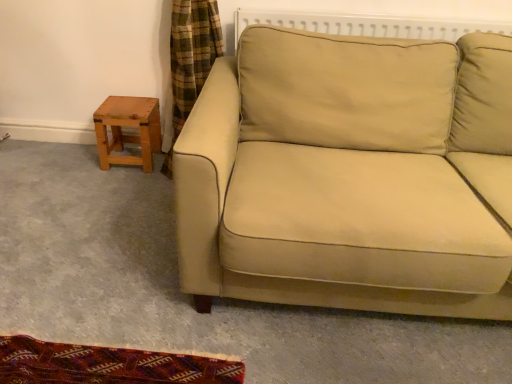
Question: From a real-world perspective, is light brown wooden stool at left positioned over beige fabric couch at center based on gravity?

Choices:
 (A) yes
 (B) no

Answer: (B)

Question: Does light brown wooden stool at left turn towards beige fabric couch at center?

Choices:
 (A) yes
 (B) no

Answer: (B)

Question: Is light brown wooden stool at left at the left side of beige fabric couch at center?

Choices:
 (A) no
 (B) yes

Answer: (B)

Question: Is light brown wooden stool at left positioned beyond the bounds of beige fabric couch at center?

Choices:
 (A) yes
 (B) no

Answer: (A)

Question: From the image's perspective, is light brown wooden stool at left on beige fabric couch at center?

Choices:
 (A) no
 (B) yes

Answer: (B)

Question: Considering the relative sizes of light brown wooden stool at left and beige fabric couch at center in the image provided, is light brown wooden stool at left taller than beige fabric couch at center?

Choices:
 (A) no
 (B) yes

Answer: (A)

Question: Does beige fabric couch at center have a greater width compared to light brown wooden stool at left?

Choices:
 (A) yes
 (B) no

Answer: (A)

Question: From the image's perspective, is beige fabric couch at center on light brown wooden stool at left?

Choices:
 (A) yes
 (B) no

Answer: (B)

Question: Can you confirm if beige fabric couch at center is bigger than light brown wooden stool at left?

Choices:
 (A) yes
 (B) no

Answer: (A)

Question: Is beige fabric couch at center in front of light brown wooden stool at left?

Choices:
 (A) yes
 (B) no

Answer: (A)

Question: Is there a large distance between beige fabric couch at center and light brown wooden stool at left?

Choices:
 (A) yes
 (B) no

Answer: (B)

Question: From a real-world perspective, is beige fabric couch at center physically below light brown wooden stool at left?

Choices:
 (A) no
 (B) yes

Answer: (A)

Question: From a real-world perspective, is light brown wooden stool at left positioned above or below beige fabric couch at center?

Choices:
 (A) below
 (B) above

Answer: (A)